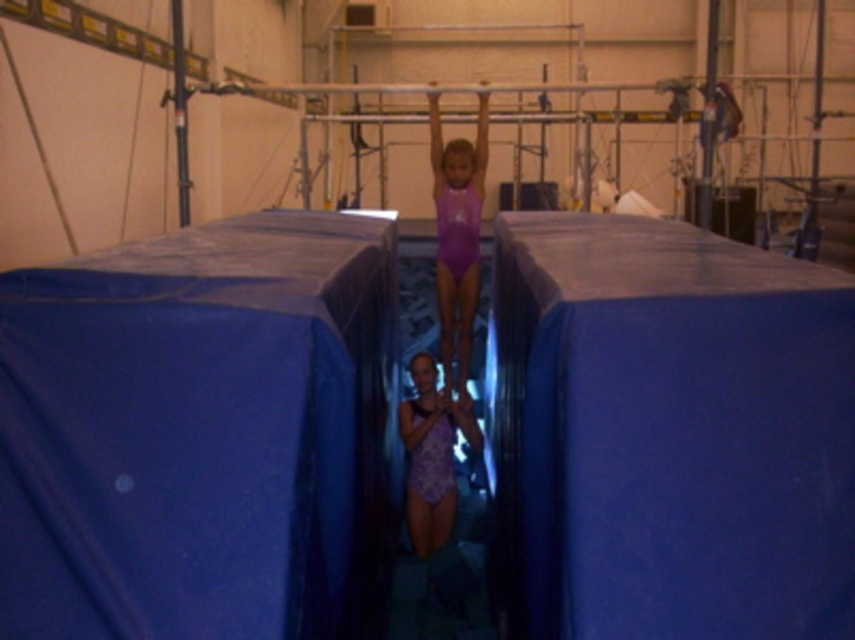
Consider the image. Can you confirm if purple matte swimsuit at center is bigger than purple textured leotard at center?

Indeed, purple matte swimsuit at center has a larger size compared to purple textured leotard at center.

Which is behind, point (485, 141) or point (420, 456)?

The point (485, 141) is more distant.

You are a GUI agent. You are given a task and a screenshot of the screen. Output one action in this format:
    pyautogui.click(x=<x>, y=<y>)
    Task: Click on the purple matte swimsuit at center
    
    Given the screenshot: What is the action you would take?
    pyautogui.click(x=457, y=234)

Does point (687, 328) come farther from viewer compared to point (441, 179)?

No, (687, 328) is closer to viewer.

Is point (555, 305) positioned in front of point (446, 227)?

That is True.

What are the coordinates of `blue fabric mat at center` in the screenshot? It's located at (668, 433).

Between blue fabric at center and purple textured leotard at center, which one appears on the right side from the viewer's perspective?

Positioned to the right is purple textured leotard at center.

Does blue fabric at center appear under purple textured leotard at center?

No.

Identify the location of blue fabric at center. The height and width of the screenshot is (640, 855). (199, 433).

The height and width of the screenshot is (640, 855). In order to click on blue fabric at center in this screenshot , I will do `click(199, 433)`.